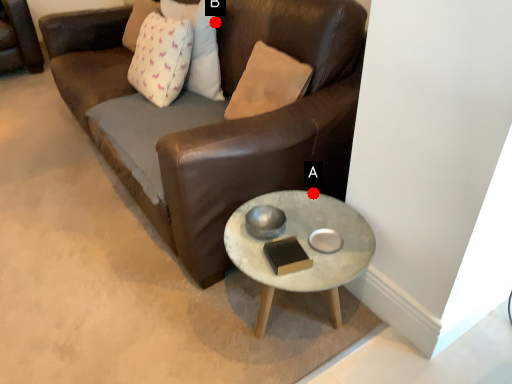
Question: Two points are circled on the image, labeled by A and B beside each circle. Which point is closer to the camera?

Choices:
 (A) A is closer
 (B) B is closer

Answer: (A)